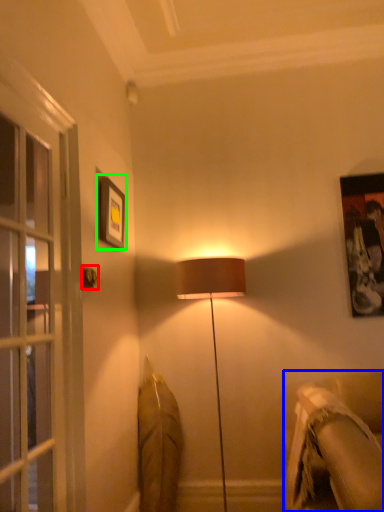
Question: Which object is the farthest from door handle (highlighted by a red box)? Choose among these: studio couch (highlighted by a blue box) or picture frame (highlighted by a green box).

Choices:
 (A) studio couch
 (B) picture frame

Answer: (A)